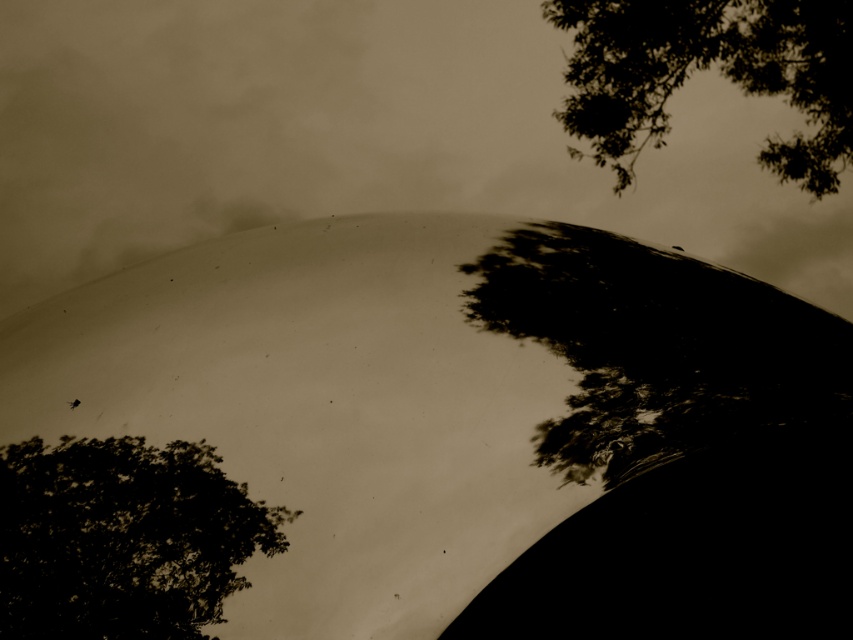
Is dark green leafy tree at lower left positioned in front of green leafy branches at upper right?

Yes, dark green leafy tree at lower left is in front of green leafy branches at upper right.

At what (x,y) coordinates should I click in order to perform the action: click on dark green leafy tree at lower left. Please return your answer as a coordinate pair (x, y). The width and height of the screenshot is (853, 640). Looking at the image, I should click on (122, 538).

Which is behind, point (136, 474) or point (801, 86)?

The point (801, 86) is behind.

The height and width of the screenshot is (640, 853). Find the location of `dark green leafy tree at lower left`. dark green leafy tree at lower left is located at coordinates click(122, 538).

Does white matte cloud at center appear on the left side of green leafy branches at upper right?

Indeed, white matte cloud at center is positioned on the left side of green leafy branches at upper right.

Based on the photo, is white matte cloud at center thinner than green leafy branches at upper right?

In fact, white matte cloud at center might be wider than green leafy branches at upper right.

Where is `white matte cloud at center`? This screenshot has height=640, width=853. white matte cloud at center is located at coordinates (357, 138).

Can you confirm if white matte cloud at center is bigger than dark green leafy tree at lower left?

Indeed, white matte cloud at center has a larger size compared to dark green leafy tree at lower left.

Which is below, white matte cloud at center or dark green leafy tree at lower left?

dark green leafy tree at lower left is lower down.

Locate an element on the screen. This screenshot has height=640, width=853. white matte cloud at center is located at coordinates (357, 138).